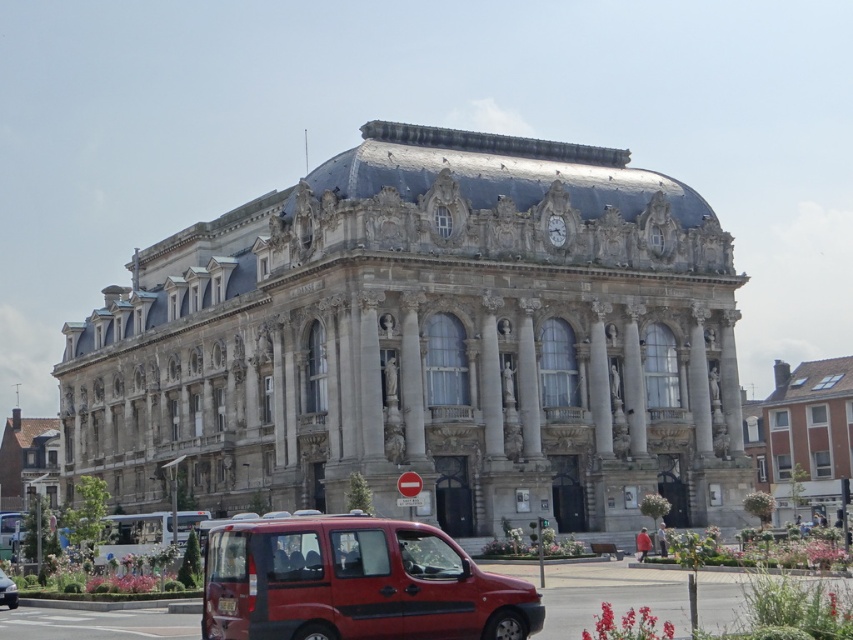
What are the coordinates of `brick building at left` in the screenshot? It's located at point(27,458).

Can you confirm if brick building at left is positioned below metallic red van at center?

Indeed, brick building at left is positioned under metallic red van at center.

Is point (33, 451) behind point (16, 595)?

Yes, point (33, 451) is farther from viewer.

Identify the location of brick building at left. This screenshot has width=853, height=640. (27, 458).

Who is higher up, red brick building at right or metallic red van at center?

red brick building at right is higher up.

The image size is (853, 640). I want to click on red brick building at right, so click(x=802, y=435).

Can you confirm if stone building at center is taller than metallic red van at center?

Yes, stone building at center is taller than metallic red van at center.

Does point (154, 483) lie in front of point (9, 595)?

No, it is behind (9, 595).

Where is `stone building at center`? Image resolution: width=853 pixels, height=640 pixels. stone building at center is located at coordinates (427, 342).